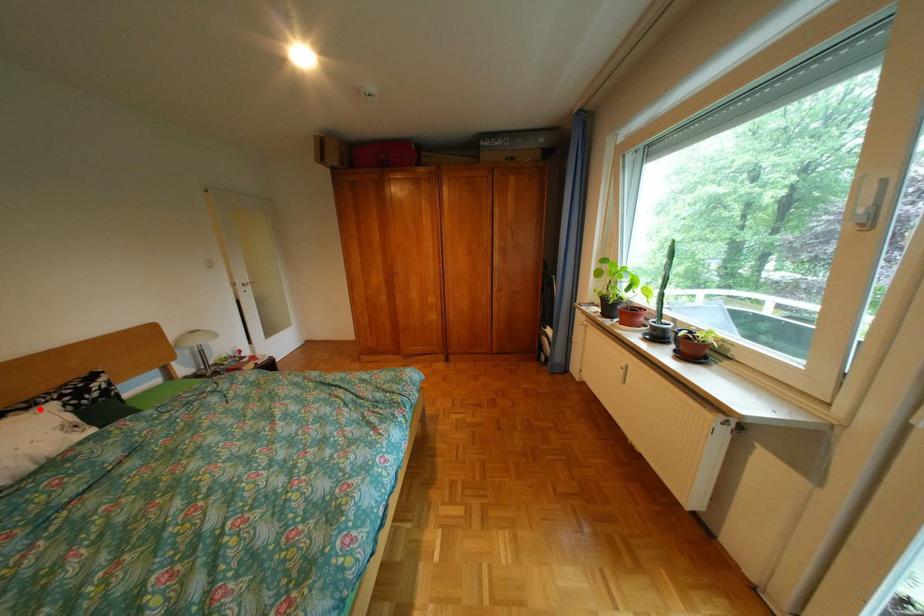
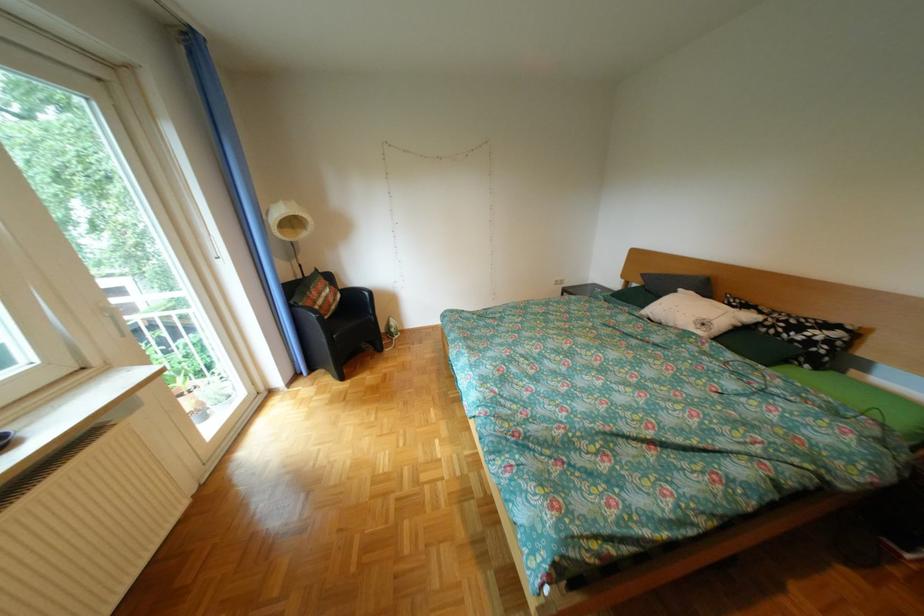
Question: I am providing you with two images of the same scene from different viewpoints. A red point is marked on the first image. At the location where the point appears in image 1, is it still visible in image 2?

Choices:
 (A) Yes
 (B) No

Answer: (A)